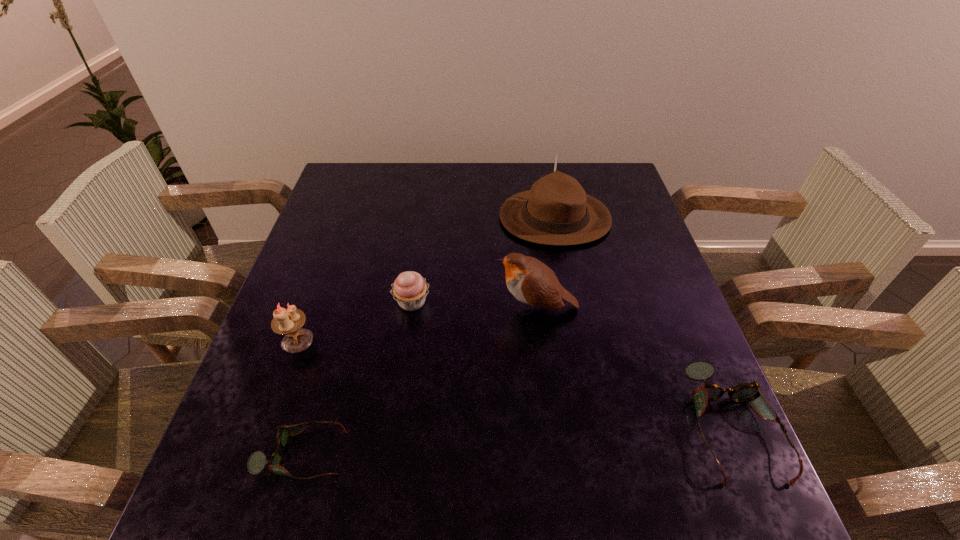
Locate an element on the screen. This screenshot has height=540, width=960. free space between the third nearest object and the fedora is located at coordinates (426, 279).

The image size is (960, 540). I want to click on the fifth closest object to the third shortest object, so click(x=699, y=370).

Choose which object is the second nearest neighbor to the fourth farthest object. Please provide its 2D coordinates. Your answer should be formatted as a tuple, i.e. [(x, y)], where the tuple contains the x and y coordinates of a point satisfying the conditions above.

[(257, 461)]

The height and width of the screenshot is (540, 960). I want to click on vacant space that satisfies the following two spatial constraints: 1. on the front-facing side of the right spectacles; 2. on the front-facing side of the left spectacles, so click(x=743, y=454).

The height and width of the screenshot is (540, 960). Find the location of `vacant space that satisfies the following two spatial constraints: 1. on the front-facing side of the second shortest object; 2. on the front-facing side of the left spectacles`. vacant space that satisfies the following two spatial constraints: 1. on the front-facing side of the second shortest object; 2. on the front-facing side of the left spectacles is located at coordinates (743, 454).